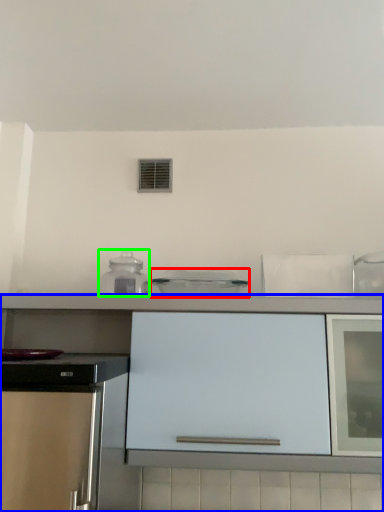
Question: Which object is the farthest from kitchen appliance (highlighted by a red box)? Choose among these: cabinetry (highlighted by a blue box) or kitchen appliance (highlighted by a green box).

Choices:
 (A) cabinetry
 (B) kitchen appliance

Answer: (A)